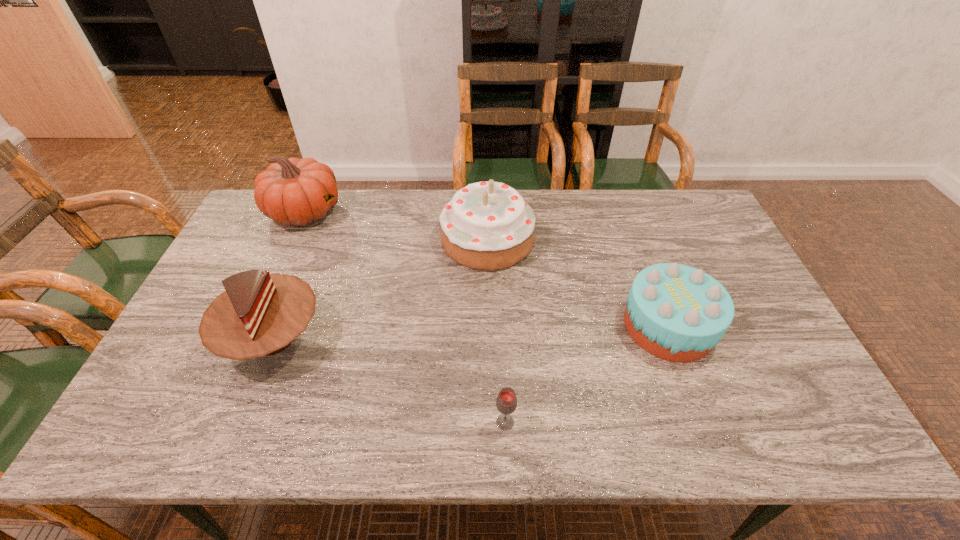
Where is `vacant space at the left edge of the desktop`? The width and height of the screenshot is (960, 540). vacant space at the left edge of the desktop is located at coordinates (206, 373).

The height and width of the screenshot is (540, 960). I want to click on free space at the right edge of the desktop, so click(751, 373).

In the image, there is a desktop. Identify the location of free space at the far right corner. (690, 213).

You are a GUI agent. You are given a task and a screenshot of the screen. Output one action in this format:
    pyautogui.click(x=<x>, y=<y>)
    Task: Click on the free area in between the leftmost cake and the nearest object
    
    Given the screenshot: What is the action you would take?
    pyautogui.click(x=389, y=380)

Find the location of `free space between the leftmost cake and the second cake from right to left`. free space between the leftmost cake and the second cake from right to left is located at coordinates (380, 289).

You are a GUI agent. You are given a task and a screenshot of the screen. Output one action in this format:
    pyautogui.click(x=<x>, y=<y>)
    Task: Click on the free area in between the farthest cake and the shortest object
    
    Given the screenshot: What is the action you would take?
    pyautogui.click(x=496, y=331)

I want to click on vacant area that lies between the leftmost cake and the rightmost object, so click(x=470, y=332).

The image size is (960, 540). I want to click on vacant region between the pumpkin and the second cake from right to left, so click(x=396, y=226).

Find the location of a particular element. vacant space in between the leftmost cake and the second cake from left to right is located at coordinates (380, 289).

Locate an element on the screen. The width and height of the screenshot is (960, 540). empty location between the pumpkin and the shortest object is located at coordinates (405, 317).